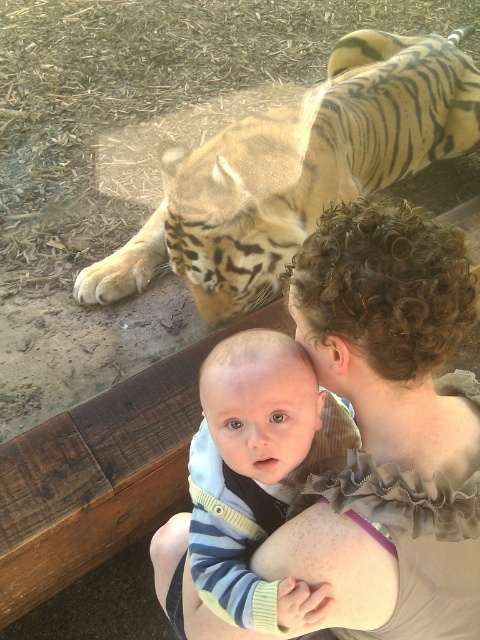
Question: Can you confirm if golden fur tiger at upper left is smaller than striped knit sweater at center?

Choices:
 (A) no
 (B) yes

Answer: (A)

Question: Among these points, which one is farthest from the camera?

Choices:
 (A) (292, 582)
 (B) (361, 598)
 (C) (292, 120)

Answer: (C)

Question: Can you confirm if curly hair at upper right is smaller than golden fur tiger at upper left?

Choices:
 (A) no
 (B) yes

Answer: (B)

Question: Which is nearer to the curly hair at upper right?

Choices:
 (A) striped knit sweater at center
 (B) golden fur tiger at upper left

Answer: (A)

Question: In this image, where is curly hair at upper right located relative to golden fur tiger at upper left?

Choices:
 (A) above
 (B) below

Answer: (B)

Question: Which is nearer to the striped knit sweater at center?

Choices:
 (A) golden fur tiger at upper left
 (B) curly hair at upper right

Answer: (B)